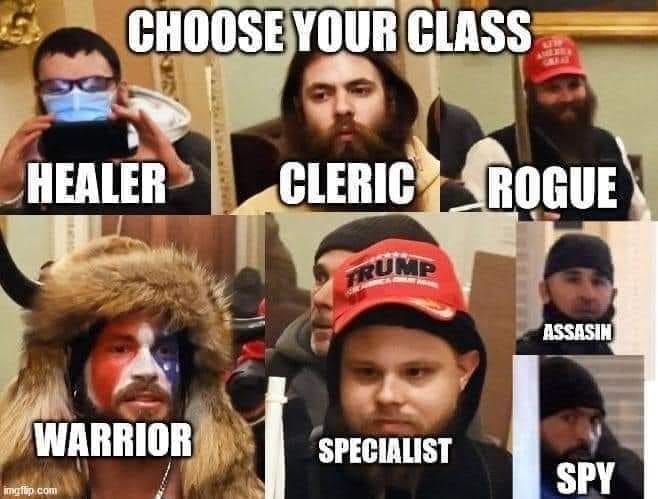
Identify the location of picture frame. Image resolution: width=658 pixels, height=499 pixels. (609, 33).